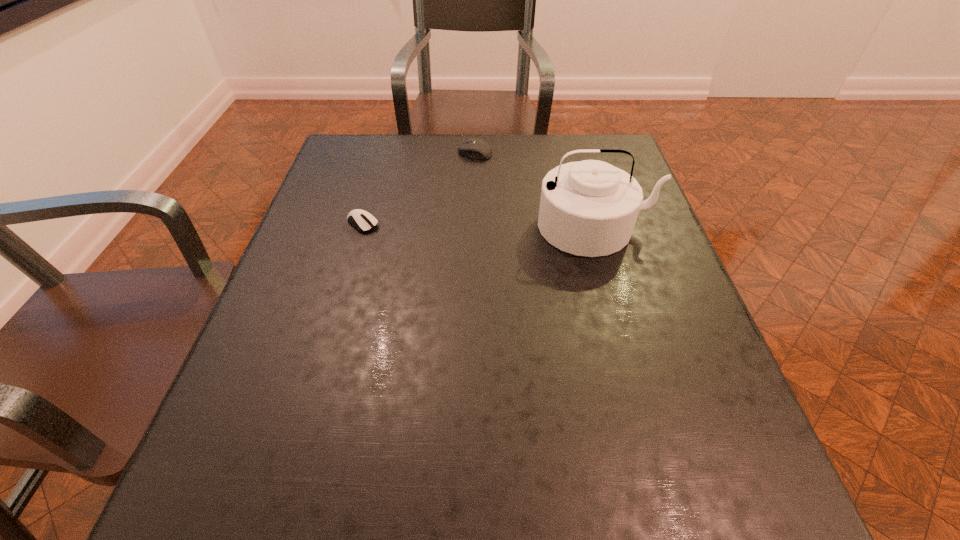
The width and height of the screenshot is (960, 540). I want to click on free space that is in between the rightmost object and the farthest object, so click(536, 190).

This screenshot has height=540, width=960. What are the coordinates of `vacant point located between the tallest object and the right mouse` in the screenshot? It's located at (536, 190).

Find the location of `free spot between the kettle and the left mouse`. free spot between the kettle and the left mouse is located at coordinates (479, 225).

Identify the location of free space between the nearer mouse and the farthest object. (419, 188).

Identify the location of free space between the right mouse and the tallest object. This screenshot has width=960, height=540. (536, 190).

This screenshot has width=960, height=540. Identify the location of free space between the rightmost object and the nearer mouse. (479, 225).

Find the location of a particular element. unoccupied position between the nearer mouse and the tallest object is located at coordinates (479, 225).

The width and height of the screenshot is (960, 540). Identify the location of vacant space that is in between the left mouse and the kettle. (479, 225).

Where is `vacant region between the nearer mouse and the farther mouse`? Image resolution: width=960 pixels, height=540 pixels. vacant region between the nearer mouse and the farther mouse is located at coordinates [419, 188].

Locate an element on the screen. free spot between the kettle and the left mouse is located at coordinates (479, 225).